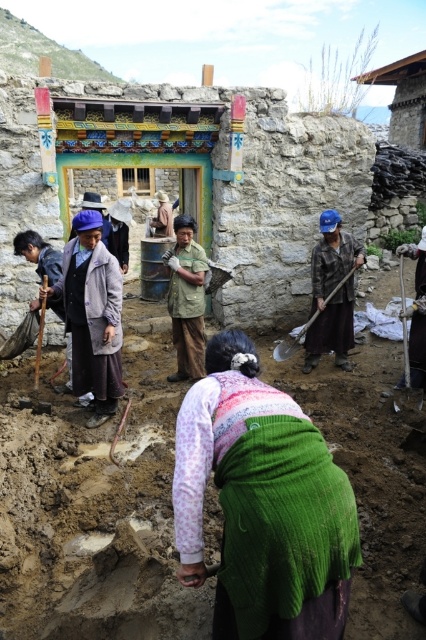
Question: Which of the following is the closest to the observer?

Choices:
 (A) dark brown wooden stick at left
 (B) camouflage fabric shirt at center
 (C) matte purple hat at center

Answer: (C)

Question: Which is farther from the knitted green shawl at center?

Choices:
 (A) blue fabric hat at center
 (B) dark brown wooden stick at left
 (C) wooden shovel at center
 (D) wooden roof at upper center

Answer: (D)

Question: Does knitted green shawl at center come behind matte purple hat at center?

Choices:
 (A) no
 (B) yes

Answer: (A)

Question: Is matte purple hat at center closer to camera compared to wooden shovel at center?

Choices:
 (A) yes
 (B) no

Answer: (A)

Question: Which point is farther from the camera taking this photo?

Choices:
 (A) (351, 268)
 (B) (187, 365)

Answer: (A)

Question: Is camouflage fabric shirt at center further to the viewer compared to wooden roof at upper center?

Choices:
 (A) yes
 (B) no

Answer: (B)